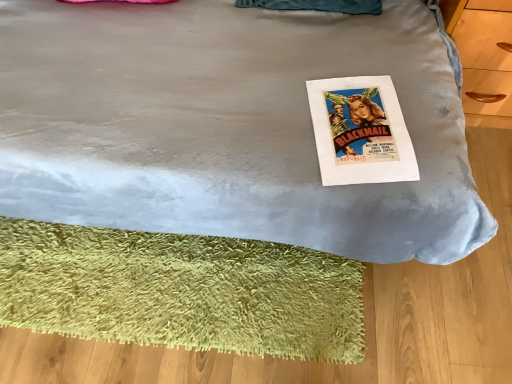
This screenshot has height=384, width=512. What do you see at coordinates (181, 291) in the screenshot?
I see `green shaggy mat at lower left` at bounding box center [181, 291].

What do you see at coordinates (360, 131) in the screenshot? This screenshot has height=384, width=512. I see `white paper at center` at bounding box center [360, 131].

Identify the location of velvet blue bed at center. (227, 125).

Who is smaller, green shaggy mat at lower left or white paper at center?

Smaller between the two is white paper at center.

Considering the sizes of green shaggy mat at lower left and white paper at center in the image, is green shaggy mat at lower left taller or shorter than white paper at center?

green shaggy mat at lower left is taller than white paper at center.

Which is more to the right, green shaggy mat at lower left or velvet blue bed at center?

green shaggy mat at lower left is more to the right.

From the image's perspective, is green shaggy mat at lower left beneath velvet blue bed at center?

Indeed, from the image's perspective, green shaggy mat at lower left is shown beneath velvet blue bed at center.

Which object is thinner, green shaggy mat at lower left or velvet blue bed at center?

With smaller width is green shaggy mat at lower left.

Based on the photo, is white paper at center facing away from green shaggy mat at lower left?

No, green shaggy mat at lower left is not at the back of white paper at center.

You are a GUI agent. You are given a task and a screenshot of the screen. Output one action in this format:
    pyautogui.click(x=<x>, y=<y>)
    Task: Click on the mat beneath the white paper at center (from a real-world perspective)
    Image resolution: width=512 pixels, height=384 pixels.
    Given the screenshot: What is the action you would take?
    pyautogui.click(x=181, y=291)

Which object is more forward, white paper at center or green shaggy mat at lower left?

white paper at center is closer to the camera.

From the image's perspective, which one is positioned lower, white paper at center or green shaggy mat at lower left?

green shaggy mat at lower left.

Considering the sizes of velvet blue bed at center and green shaggy mat at lower left in the image, is velvet blue bed at center bigger or smaller than green shaggy mat at lower left?

velvet blue bed at center is bigger than green shaggy mat at lower left.

Which object is wider, velvet blue bed at center or green shaggy mat at lower left?

With larger width is velvet blue bed at center.

Which object is more forward, velvet blue bed at center or green shaggy mat at lower left?

velvet blue bed at center is more forward.

Is velvet blue bed at center oriented towards white paper at center?

Yes.

From the image's perspective, which one is positioned lower, velvet blue bed at center or white paper at center?

From the image's view, white paper at center is below.

In the scene shown: From a real-world perspective, which object rests below the other?

white paper at center.

From a real-world perspective, is white paper at center positioned over velvet blue bed at center based on gravity?

No.

Consider the image. Is white paper at center oriented towards velvet blue bed at center?

Yes, white paper at center is aimed at velvet blue bed at center.

Where is `bed above the white paper at center (from the image's perspective)`? Image resolution: width=512 pixels, height=384 pixels. bed above the white paper at center (from the image's perspective) is located at coordinates (227, 125).

Can we say white paper at center lies outside velvet blue bed at center?

Actually, white paper at center is at least partially inside velvet blue bed at center.

At what (x,y) coordinates should I click in order to perform the action: click on mat behind the white paper at center. Please return your answer as a coordinate pair (x, y). Looking at the image, I should click on (181, 291).

What are the coordinates of `bed above the green shaggy mat at lower left (from the image's perspective)` in the screenshot? It's located at (227, 125).

When comparing their distances from green shaggy mat at lower left, does white paper at center or velvet blue bed at center seem further?

white paper at center lies further to green shaggy mat at lower left than the other object.

When comparing their distances from white paper at center, does green shaggy mat at lower left or velvet blue bed at center seem further?

green shaggy mat at lower left is positioned further to the anchor white paper at center.

Estimate the real-world distances between objects in this image. Which object is closer to velvet blue bed at center, white paper at center or green shaggy mat at lower left?

Based on the image, white paper at center appears to be nearer to velvet blue bed at center.

Which object lies further to the anchor point green shaggy mat at lower left, velvet blue bed at center or white paper at center?

white paper at center is further to green shaggy mat at lower left.

Looking at the image, which one is located further to velvet blue bed at center, green shaggy mat at lower left or white paper at center?

green shaggy mat at lower left is further to velvet blue bed at center.

Based on their spatial positions, is velvet blue bed at center or green shaggy mat at lower left further from white paper at center?

green shaggy mat at lower left.

Find the location of `magazine between velvet blue bed at center and green shaggy mat at lower left from top to bottom`. magazine between velvet blue bed at center and green shaggy mat at lower left from top to bottom is located at coordinates (360, 131).